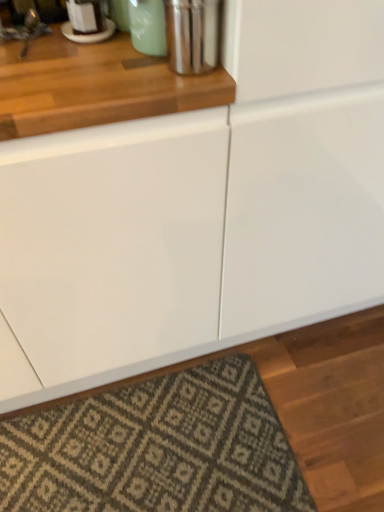
Question: Is textured beige rug at lower center in front of or behind shiny metallic canister at upper center in the image?

Choices:
 (A) front
 (B) behind

Answer: (B)

Question: Is textured beige rug at lower center taller or shorter than shiny metallic canister at upper center?

Choices:
 (A) short
 (B) tall

Answer: (A)

Question: From a real-world perspective, is textured beige rug at lower center positioned above or below shiny metallic canister at upper center?

Choices:
 (A) above
 (B) below

Answer: (B)

Question: From the image's perspective, relative to textured beige rug at lower center, is shiny metallic canister at upper center above or below?

Choices:
 (A) below
 (B) above

Answer: (B)

Question: Does point [185, 29] appear closer or farther from the camera than point [26, 506]?

Choices:
 (A) closer
 (B) farther

Answer: (A)

Question: Relative to textured beige rug at lower center, is shiny metallic canister at upper center in front or behind?

Choices:
 (A) front
 (B) behind

Answer: (A)

Question: Choose the correct answer: Is shiny metallic canister at upper center inside textured beige rug at lower center or outside it?

Choices:
 (A) outside
 (B) inside

Answer: (A)